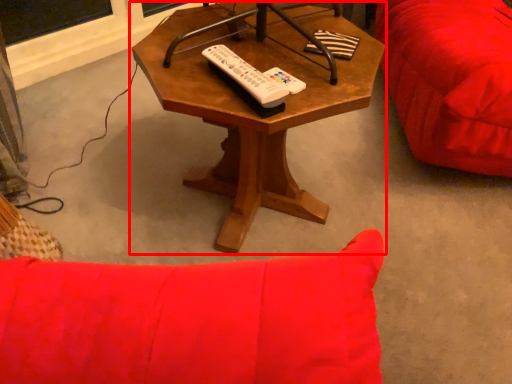
Question: From the image's perspective, considering the relative positions of coffee table (annotated by the red box) and remote in the image provided, where is coffee table (annotated by the red box) located with respect to the staircase?

Choices:
 (A) above
 (B) below

Answer: (B)